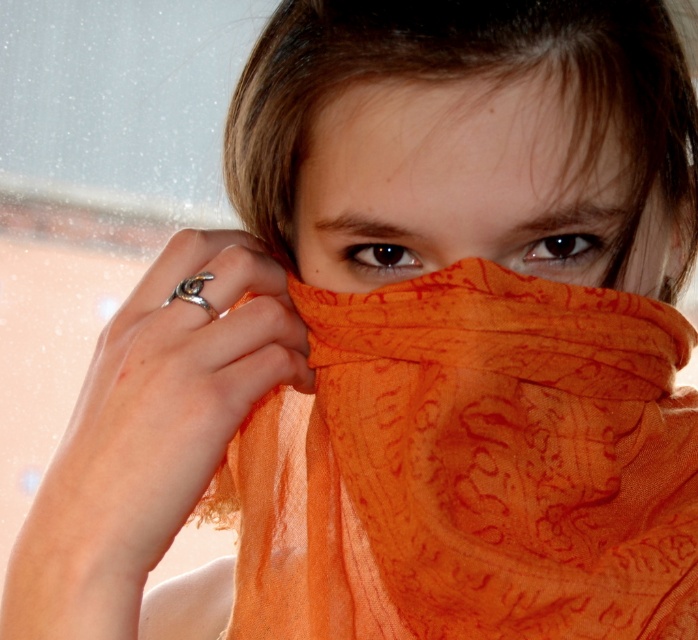
Looking at the image, which object is positioned higher up between the brownmatteeyes at center and the brown matte eye at upper center?

The brown matte eye at upper center is positioned higher up than the brownmatteeyes at center.

You are an AI analyzing a portrait. The image shows a person with their eyes covered by an orange fabric. There is a point at coordinates point [461,177]. What does this point represent?

The point at coordinates point [461,177] represents the brown matte eyes at center.